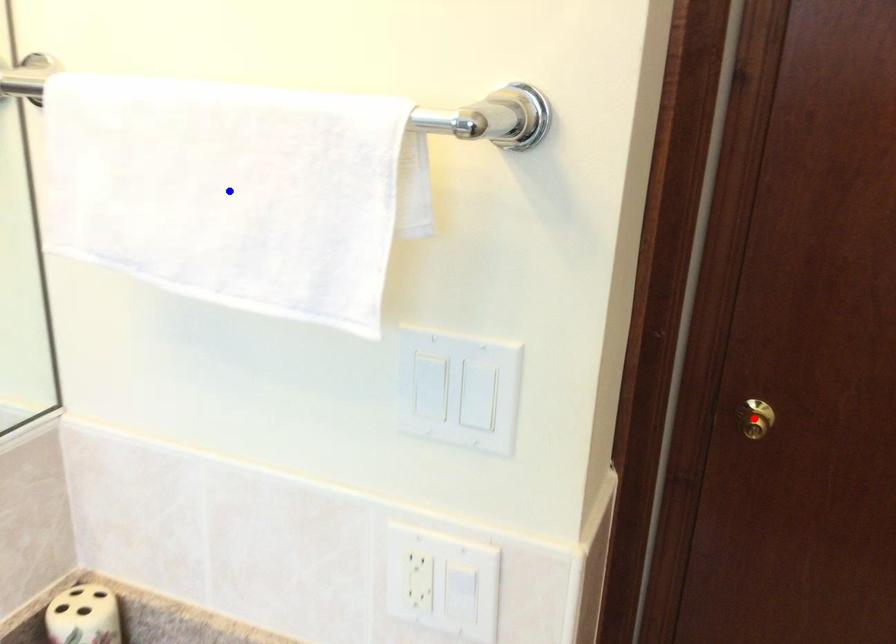
Question: Which of the two points in the image is closer to the camera?

Choices:
 (A) Blue point is closer.
 (B) Red point is closer.

Answer: (A)